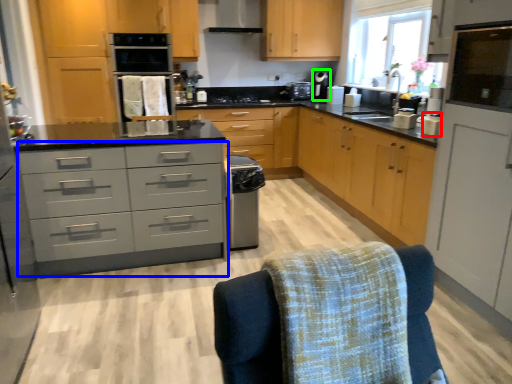
Question: Which object is positioned farthest from appliance (highlighted by a red box)? Select from chest of drawers (highlighted by a blue box) and coffee machine (highlighted by a green box).

Choices:
 (A) chest of drawers
 (B) coffee machine

Answer: (B)